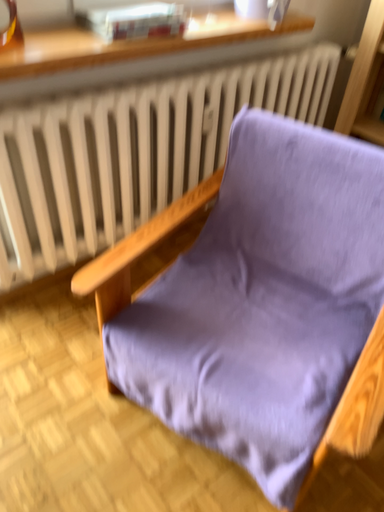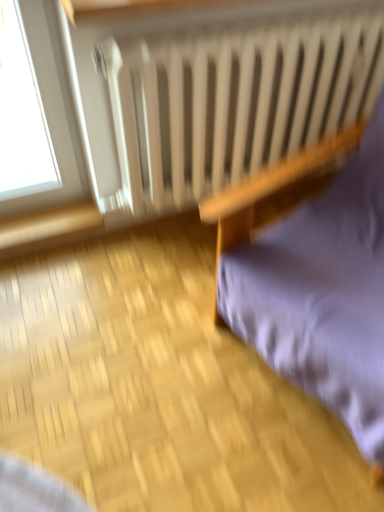
Question: Which way did the camera rotate in the video?

Choices:
 (A) rotated right
 (B) rotated left

Answer: (B)